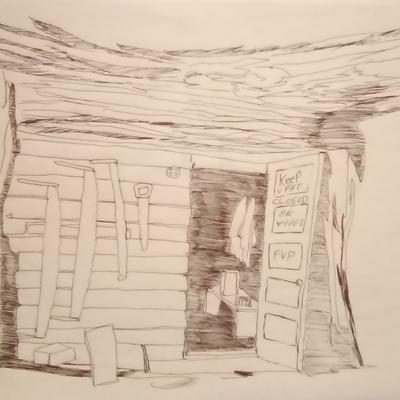
Identify the location of door section. pos(303,179), pos(300,210), pos(291,246), pos(280,300), pos(274,332).